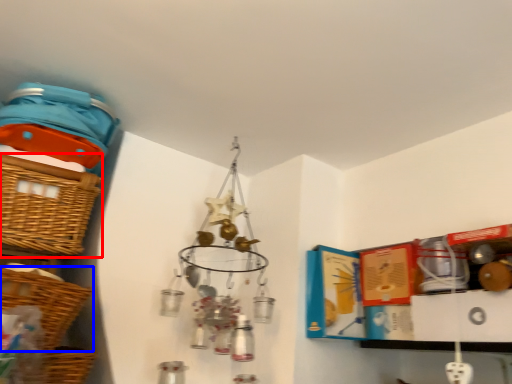
Question: Among these objects, which one is farthest to the camera, basket (highlighted by a red box) or basket (highlighted by a blue box)?

Choices:
 (A) basket
 (B) basket

Answer: (A)